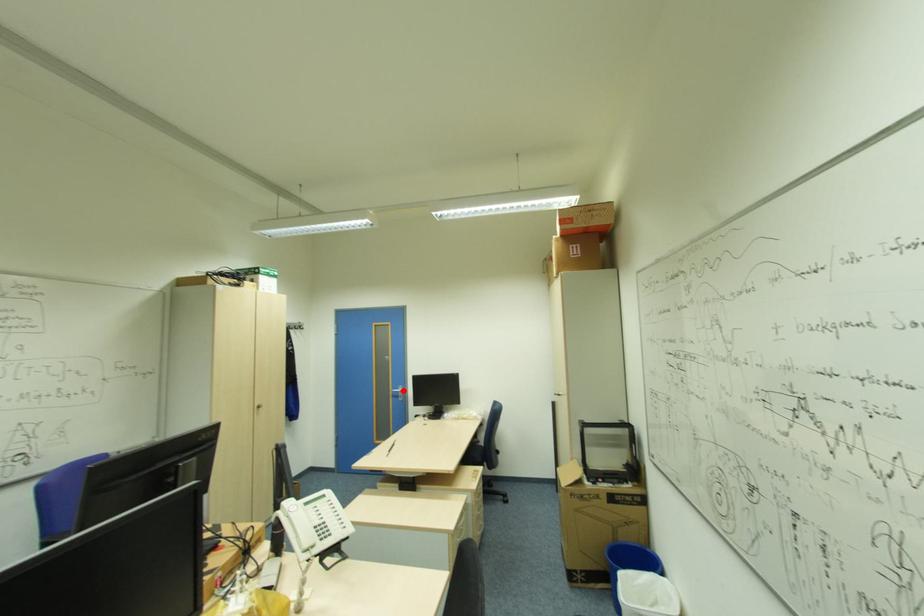
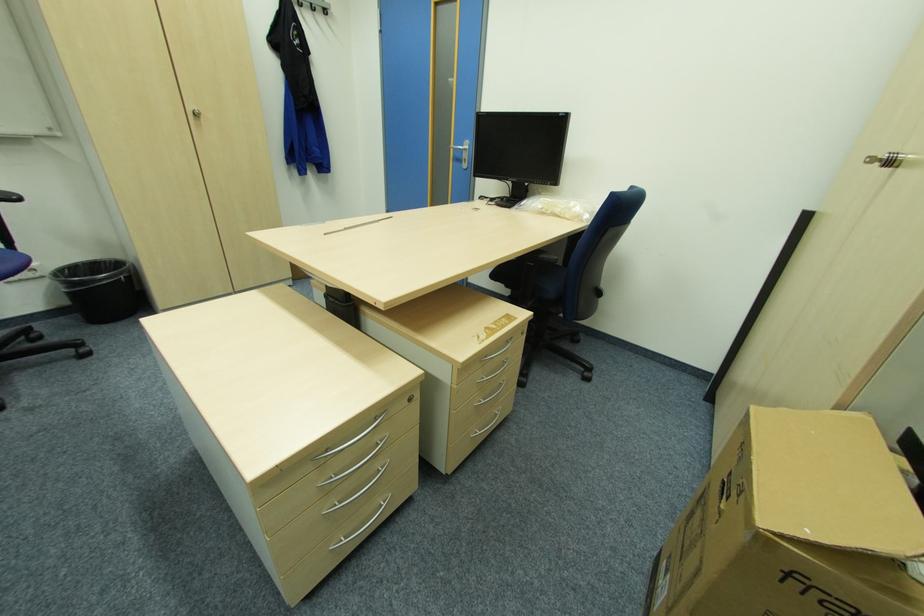
Question: A red point is marked in image1. In image2, is the corresponding 3D point closer to the camera or farther? Reply with the corresponding letter.

Choices:
 (A) The corresponding 3D point is closer.
 (B) The corresponding 3D point is farther.

Answer: (A)